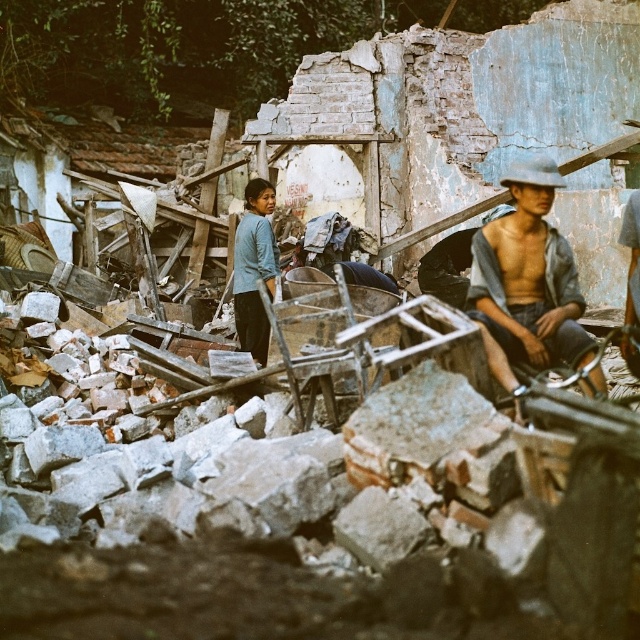
Question: Can you confirm if gray fabric shirt at center is positioned below blue fabric shirt at center?

Choices:
 (A) no
 (B) yes

Answer: (B)

Question: Is gray fabric shirt at center further to the viewer compared to blue fabric shirt at center?

Choices:
 (A) no
 (B) yes

Answer: (A)

Question: Can you confirm if gray fabric shirt at center is wider than blue fabric shirt at center?

Choices:
 (A) no
 (B) yes

Answer: (B)

Question: Which of the following is the closest to the observer?

Choices:
 (A) gray fabric shirt at center
 (B) blue fabric shirt at center

Answer: (A)

Question: Which object appears farthest from the camera in this image?

Choices:
 (A) gray fabric shirt at center
 (B) blue fabric shirt at center

Answer: (B)